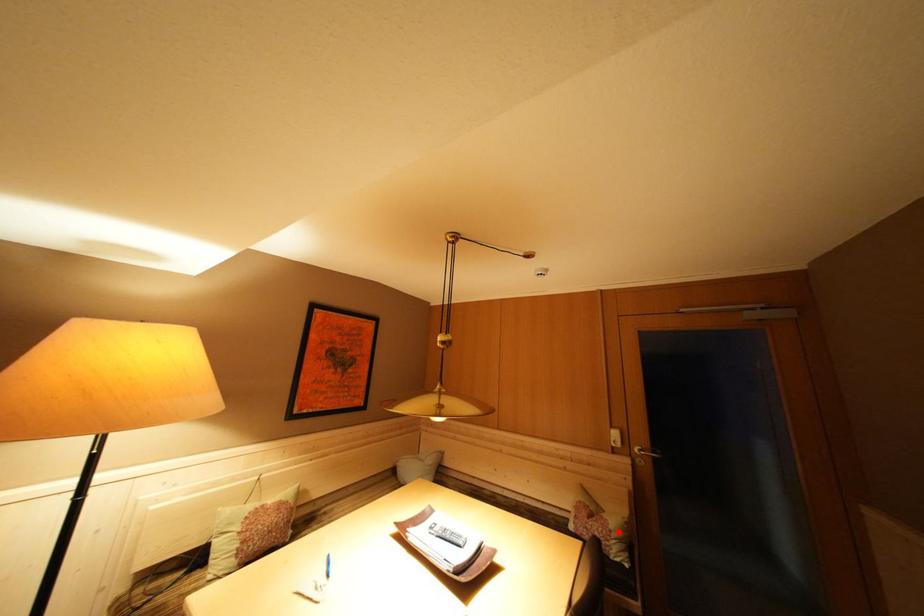
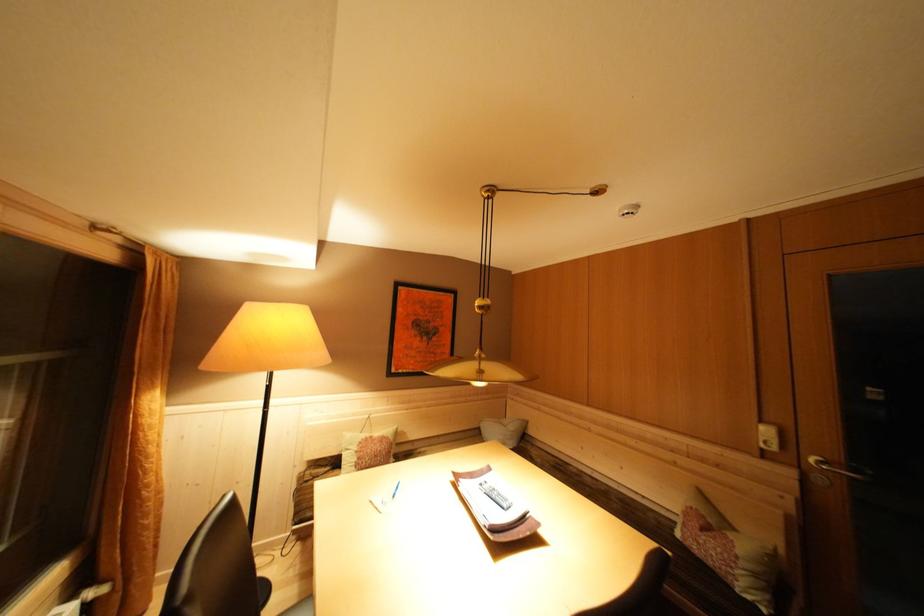
Question: I am providing you with two images of the same scene from different viewpoints. In image1, a red point is highlighted. Considering the same 3D point in image2, which of the following is correct?

Choices:
 (A) It is closer
 (B) It is farther

Answer: (A)